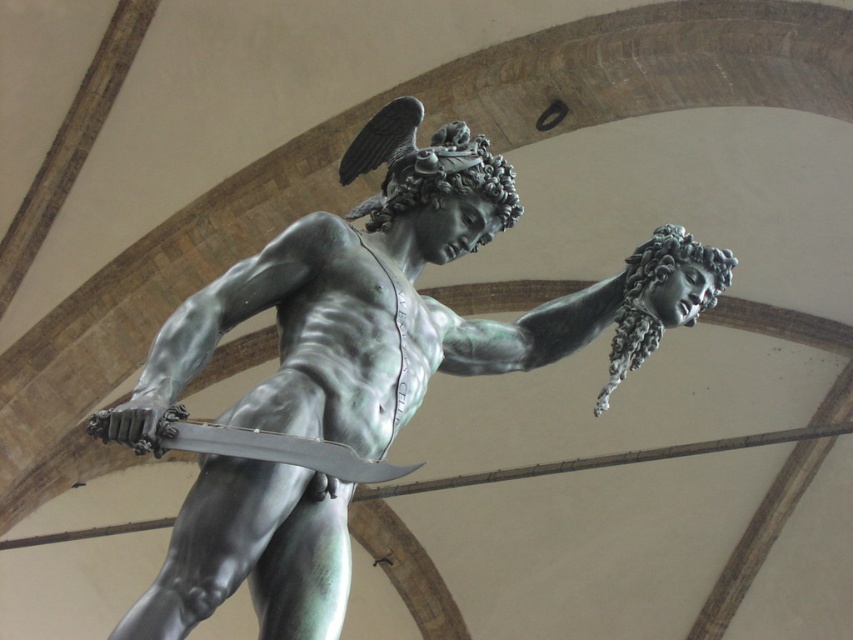
Question: Can you confirm if green patina bronze statue at center is positioned to the left of polished bronze sword at center?

Choices:
 (A) yes
 (B) no

Answer: (B)

Question: Which point is farther to the camera?

Choices:
 (A) green patina bronze statue at center
 (B) polished bronze sword at center

Answer: (B)

Question: Which point is farther from the camera taking this photo?

Choices:
 (A) [276, 444]
 (B) [345, 220]

Answer: (B)

Question: Can you confirm if green patina bronze statue at center is wider than polished bronze sword at center?

Choices:
 (A) yes
 (B) no

Answer: (A)

Question: Does green patina bronze statue at center appear on the right side of polished bronze sword at center?

Choices:
 (A) no
 (B) yes

Answer: (B)

Question: Which object is farther from the camera taking this photo?

Choices:
 (A) polished bronze sword at center
 (B) green patina bronze statue at center

Answer: (A)